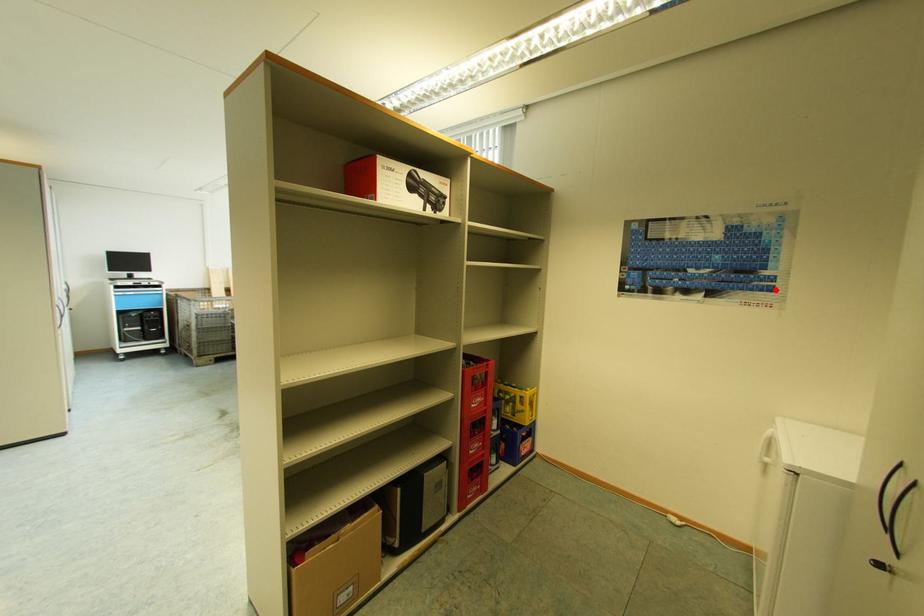
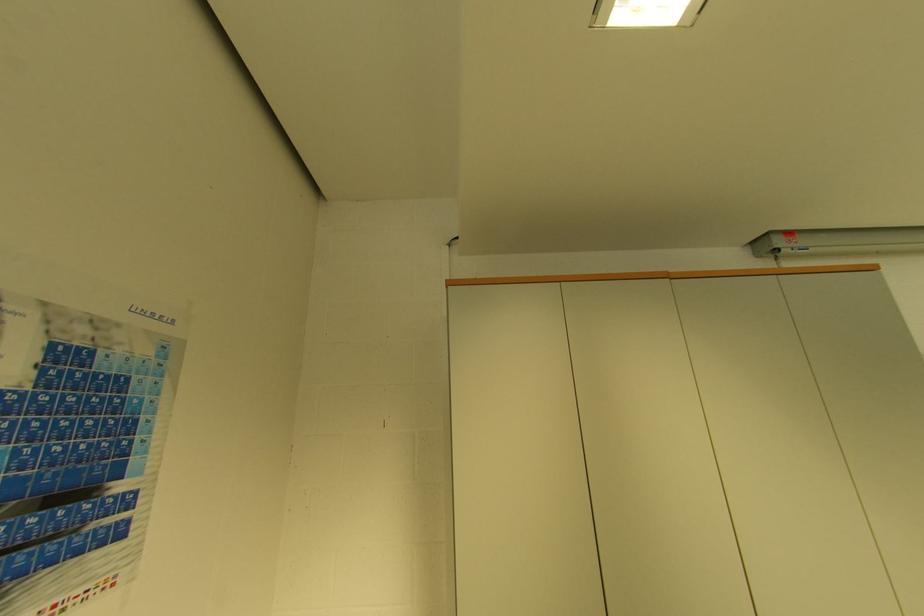
The point at the highlighted location is marked in the first image. Where is the corresponding point in the second image?

(123, 533)